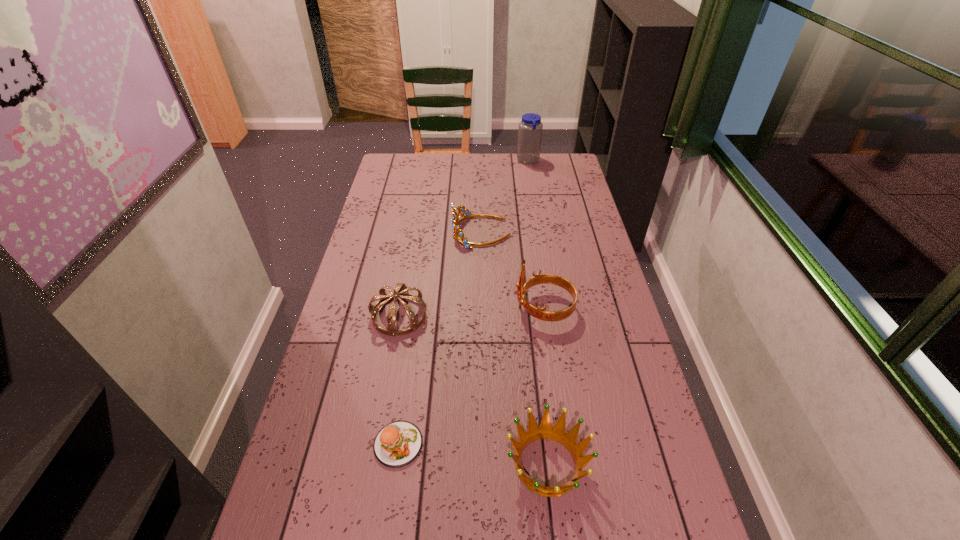
At what (x,y) coordinates should I click in order to perform the action: click on free point that satisfies the following two spatial constraints: 1. with a carrying loop on the side of the farthest object; 2. on the front side of the leftmost tiara. Please return your answer as a coordinate pair (x, y). The width and height of the screenshot is (960, 540). Looking at the image, I should click on (554, 316).

Identify the location of free region that satisfies the following two spatial constraints: 1. on the front side of the leftmost tiara; 2. on the right side of the shortest object. The height and width of the screenshot is (540, 960). (376, 444).

The image size is (960, 540). In order to click on vacant region that satisfies the following two spatial constraints: 1. on the front-facing side of the tallest tiara; 2. on the front side of the patty in this screenshot , I will do `click(564, 444)`.